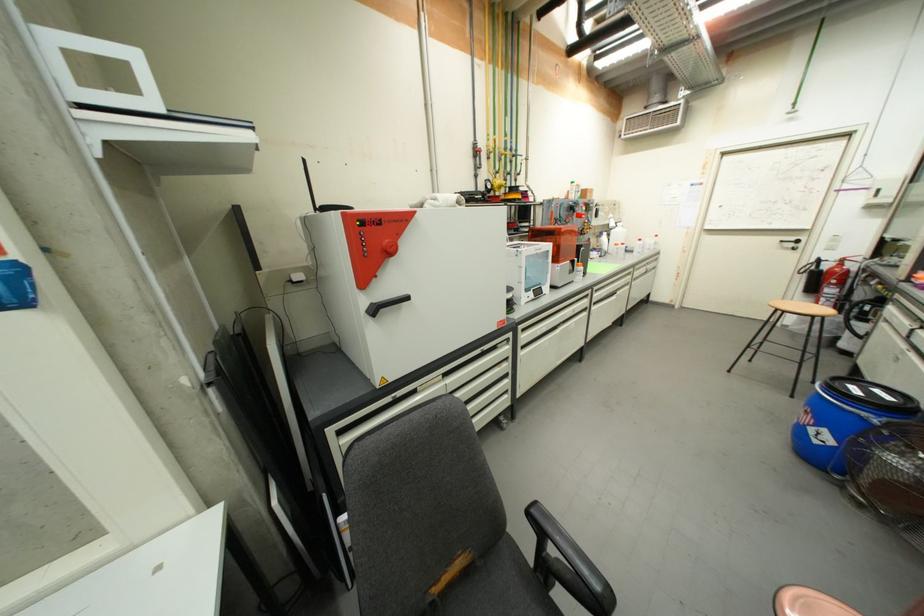
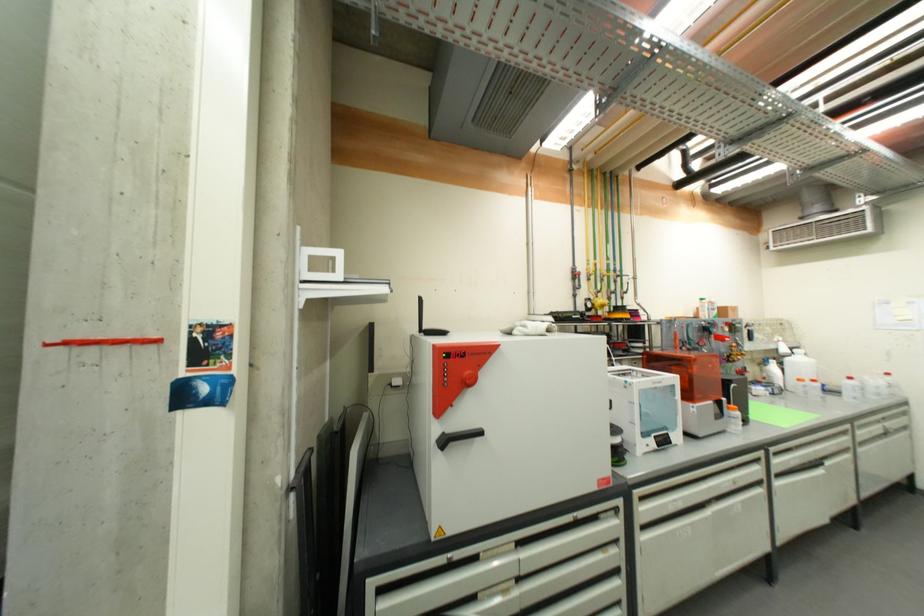
Locate, in the second image, the point that corresponds to pixel 396 249 in the first image.

(476, 381)